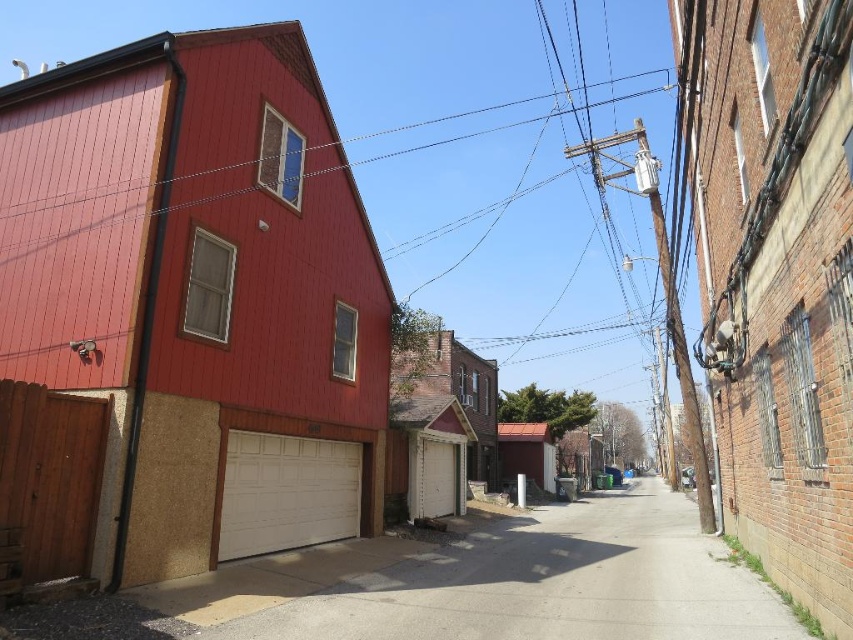
Between point (677, 508) and point (241, 540), which one is positioned in front?

Point (241, 540) is more forward.

Which of these two, white smooth driveway at lower center or white textured garage door at lower center, stands taller?

white smooth driveway at lower center is taller.

Does point (621, 576) come behind point (303, 492)?

That is False.

Locate an element on the screen. Image resolution: width=853 pixels, height=640 pixels. white smooth driveway at lower center is located at coordinates (548, 582).

Who is more distant from viewer, (463, 548) or (460, 410)?

Positioned behind is point (460, 410).

Is point (704, 598) farther from viewer compared to point (421, 515)?

No, (704, 598) is closer to viewer.

The width and height of the screenshot is (853, 640). I want to click on white smooth driveway at lower center, so click(x=548, y=582).

Does white textured garage door at lower center have a greater width compared to white painted wood garage at center?

Correct, the width of white textured garage door at lower center exceeds that of white painted wood garage at center.

Can you confirm if white textured garage door at lower center is positioned above white painted wood garage at center?

Yes.

Which is in front, point (231, 499) or point (416, 424)?

Point (231, 499) is in front.

You are a GUI agent. You are given a task and a screenshot of the screen. Output one action in this format:
    pyautogui.click(x=<x>, y=<y>)
    Task: Click on the white textured garage door at lower center
    This screenshot has width=853, height=640.
    Given the screenshot: What is the action you would take?
    pyautogui.click(x=286, y=492)